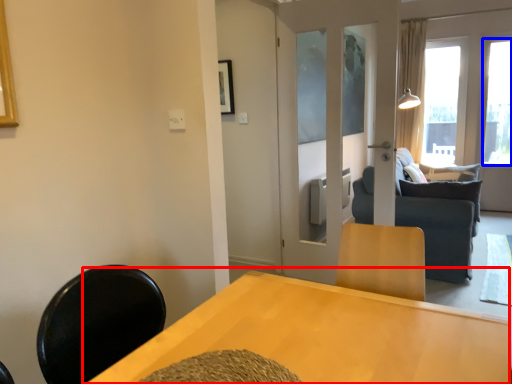
Question: Among these objects, which one is farthest to the camera, table (highlighted by a red box) or window (highlighted by a blue box)?

Choices:
 (A) table
 (B) window

Answer: (B)